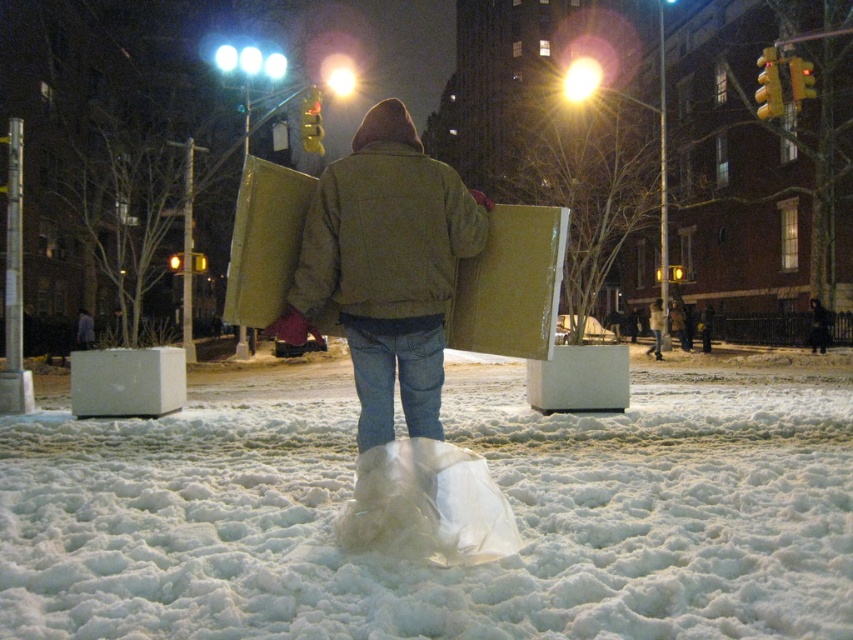
You are a photographer trying to capture the scene of the person walking through the snow. Given that the white fluffy snow at center and the matte brown jacket at center are both in your viewfinder, which one would you adjust your camera settings to focus on if you want to emphasize the size difference between them?

The white fluffy snow at center is bigger than the matte brown jacket at center, so to emphasize the size difference, focus on the white fluffy snow at center to highlight its larger presence in the frame.

In the scene shown: You are a photographer trying to capture the scene of the person walking through the snow. Based on the image, which object occupies more horizontal space in the frame between the white fluffy snow at center and the matte brown jacket at center?

The white fluffy snow at center occupies more horizontal space in the frame than the matte brown jacket at center since its width surpasses that of the jacket.